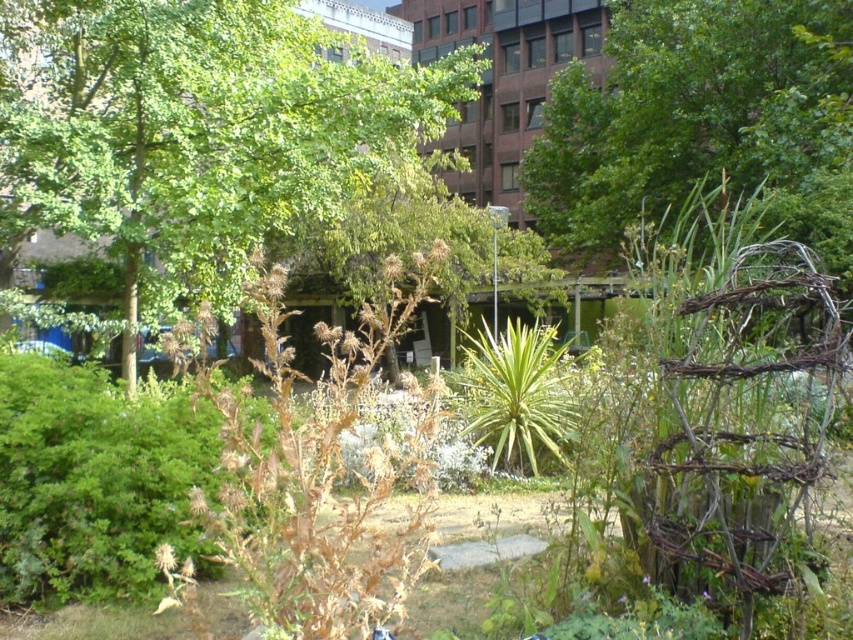
Question: Does green leafy tree at upper left appear under green leafy tree at upper right?

Choices:
 (A) yes
 (B) no

Answer: (A)

Question: Is green leafy tree at upper left to the left of green leafy bush at center from the viewer's perspective?

Choices:
 (A) no
 (B) yes

Answer: (B)

Question: Among these points, which one is nearest to the camera?

Choices:
 (A) (659, 198)
 (B) (177, 428)
 (C) (527, 336)
 (D) (196, 80)

Answer: (B)

Question: From the image, what is the correct spatial relationship of green leafy tree at upper left in relation to green leafy plant at center?

Choices:
 (A) below
 (B) above

Answer: (B)

Question: Which of these objects is positioned farthest from the green leafy plant at center?

Choices:
 (A) green leafy bush at center
 (B) green leafy tree at upper left
 (C) green leafy tree at upper right

Answer: (B)

Question: Estimate the real-world distances between objects in this image. Which object is closer to the green leafy bush at center?

Choices:
 (A) green leafy tree at upper left
 (B) green leafy tree at upper right

Answer: (A)